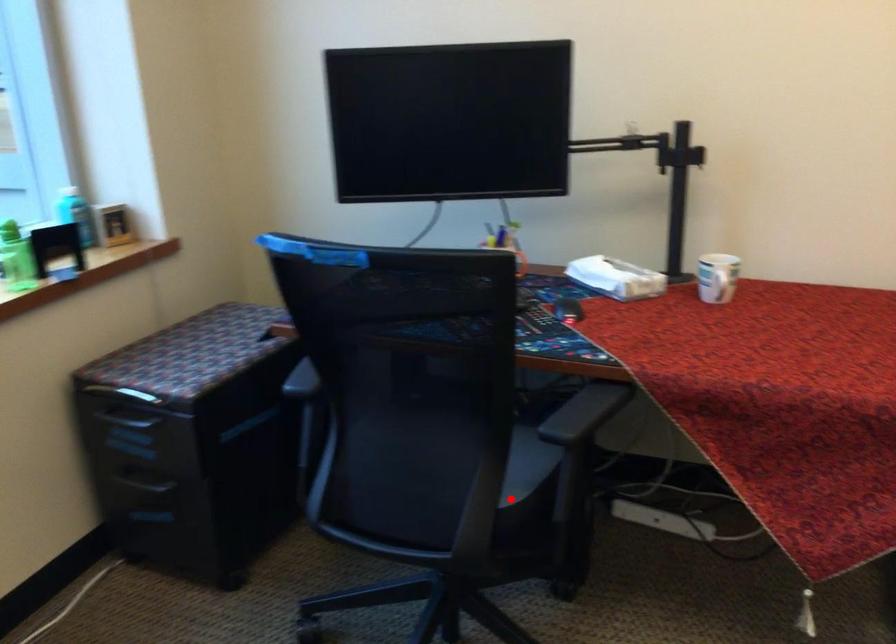
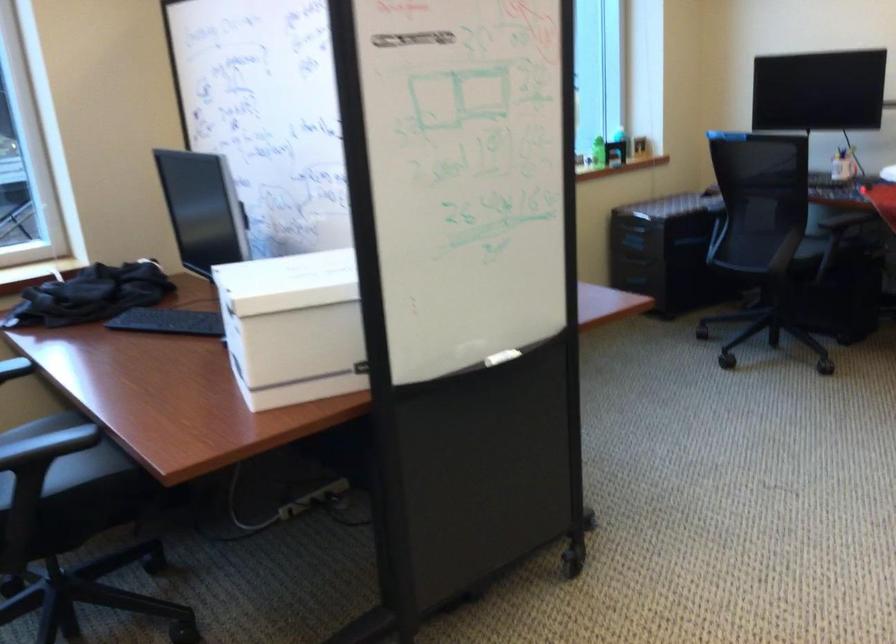
Find the pixel in the second image that matches the highlighted location in the first image.

(811, 248)